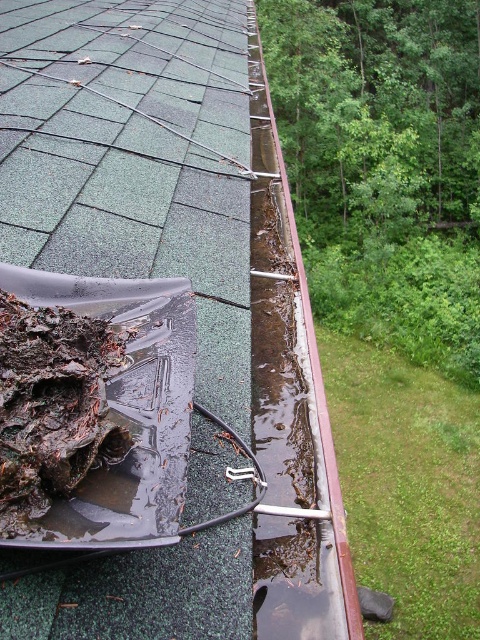
Can you confirm if green shingles at upper left is taller than brown organic matter at lower left?

Correct, green shingles at upper left is much taller as brown organic matter at lower left.

Is point (81, 77) in front of point (39, 348)?

No, it is not.

Image resolution: width=480 pixels, height=640 pixels. I want to click on green shingles at upper left, so click(126, 140).